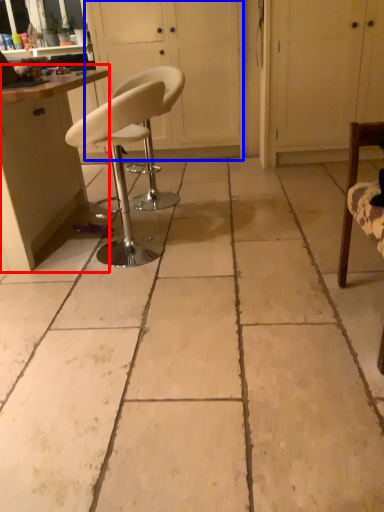
Question: Which of the following is the farthest to the observer, cabinetry (highlighted by a red box) or screen door (highlighted by a blue box)?

Choices:
 (A) cabinetry
 (B) screen door

Answer: (B)